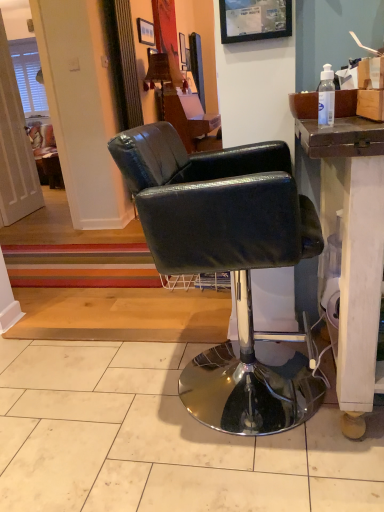
At what (x,y) coordinates should I click in order to perform the action: click on transparent plastic bottle at upper right. Please return your answer as a coordinate pair (x, y). The height and width of the screenshot is (512, 384). Looking at the image, I should click on (326, 97).

The image size is (384, 512). What do you see at coordinates (145, 32) in the screenshot? I see `matte black picture frame at upper center, which is counted as the first picture frame, starting from the top` at bounding box center [145, 32].

Measure the distance between point (255, 267) and camera.

1.12 meters.

The image size is (384, 512). What do you see at coordinates (254, 20) in the screenshot?
I see `matte plastic picture frame at upper center, placed as the first picture frame when sorted from bottom to top` at bounding box center [254, 20].

Image resolution: width=384 pixels, height=512 pixels. I want to click on transparent plastic bottle at upper right, so click(326, 97).

In terms of size, does brown cardboard box at upper right appear bigger or smaller than transparent plastic bottle at upper right?

brown cardboard box at upper right is bigger than transparent plastic bottle at upper right.

Is brown cardboard box at upper right in front of or behind transparent plastic bottle at upper right in the image?

Clearly, brown cardboard box at upper right is behind transparent plastic bottle at upper right.

Looking at this image, from a real-world perspective, which is physically below, brown cardboard box at upper right or transparent plastic bottle at upper right?

brown cardboard box at upper right is physically lower.

Do you think brown cardboard box at upper right is within white tile at center, or outside of it?

The correct answer is: outside.

Measure the distance from brown cardboard box at upper right to white tile at center.

brown cardboard box at upper right is 1.15 meters away from white tile at center.

Where is `tile that appears in front of the brown cardboard box at upper right`? tile that appears in front of the brown cardboard box at upper right is located at coordinates (159, 440).

From the picture: Considering the sizes of objects brown cardboard box at upper right and white tile at center in the image provided, who is thinner, brown cardboard box at upper right or white tile at center?

With smaller width is brown cardboard box at upper right.

Is brown cardboard box at upper right facing towards wooden lampshade at upper center?

No, brown cardboard box at upper right is not turned towards wooden lampshade at upper center.

Does brown cardboard box at upper right contain wooden lampshade at upper center?

No.

Which is more to the left, brown cardboard box at upper right or wooden lampshade at upper center?

wooden lampshade at upper center.

Which is farther from the camera, (273, 8) or (329, 88)?

The point (273, 8) is farther.

Would you say transparent plastic bottle at upper right is part of matte plastic picture frame at upper center, which appears as the 2th picture frame when viewed from the back,'s contents?

That's incorrect, transparent plastic bottle at upper right is not inside matte plastic picture frame at upper center, which appears as the 2th picture frame when viewed from the back.

Is matte plastic picture frame at upper center, the first picture frame in the front-to-back sequence, to the left or to the right of transparent plastic bottle at upper right in the image?

From the image, it's evident that matte plastic picture frame at upper center, the first picture frame in the front-to-back sequence, is to the left of transparent plastic bottle at upper right.

Does black leather chair at center have a greater width compared to transparent plastic bottle at upper right?

Correct, the width of black leather chair at center exceeds that of transparent plastic bottle at upper right.

Is black leather chair at center to the left of transparent plastic bottle at upper right from the viewer's perspective?

Yes, black leather chair at center is to the left of transparent plastic bottle at upper right.

From a real-world perspective, is black leather chair at center physically above transparent plastic bottle at upper right?

No, from a real-world perspective, black leather chair at center is not on top of transparent plastic bottle at upper right.

Would you say black leather chair at center contains transparent plastic bottle at upper right?

Actually, transparent plastic bottle at upper right is outside black leather chair at center.

Considering the points (330, 66) and (349, 103), which point is behind, point (330, 66) or point (349, 103)?

The point (330, 66) is more distant.

Is transparent plastic bottle at upper right closer to the viewer compared to brown cardboard box at upper right?

That is True.

In the scene shown: Is transparent plastic bottle at upper right outside of brown cardboard box at upper right?

Yes, transparent plastic bottle at upper right is outside of brown cardboard box at upper right.

From the image's perspective, which one is positioned higher, transparent plastic bottle at upper right or brown cardboard box at upper right?

brown cardboard box at upper right is shown above in the image.

Can you confirm if wooden lampshade at upper center is positioned to the right of transparent plastic bottle at upper right?

No.

Between wooden lampshade at upper center and transparent plastic bottle at upper right, which one has larger width?

wooden lampshade at upper center.

Can you confirm if wooden lampshade at upper center is bigger than transparent plastic bottle at upper right?

Correct, wooden lampshade at upper center is larger in size than transparent plastic bottle at upper right.

The width and height of the screenshot is (384, 512). Identify the location of bottle on the left of brown cardboard box at upper right. (326, 97).

This screenshot has height=512, width=384. I want to click on box above the white tile at center (from a real-world perspective), so click(x=304, y=105).

When comparing their distances from wooden lampshade at upper center, does matte black picture frame at upper center, the 2th picture frame in the bottom-to-top sequence, or matte plastic picture frame at upper center, the first picture frame in the front-to-back sequence, seem closer?

matte black picture frame at upper center, the 2th picture frame in the bottom-to-top sequence.

Estimate the real-world distances between objects in this image. Which object is closer to transparent plastic bottle at upper right, brown cardboard box at upper right or white tile at center?

The object closer to transparent plastic bottle at upper right is brown cardboard box at upper right.

When comparing their distances from matte plastic picture frame at upper center, the 1th picture frame when ordered from right to left, does black leather chair at center or white tile at center seem further?

Based on the image, white tile at center appears to be further to matte plastic picture frame at upper center, the 1th picture frame when ordered from right to left.

Estimate the real-world distances between objects in this image. Which object is closer to matte black picture frame at upper center, which is counted as the first picture frame, starting from the top, wooden lampshade at upper center or transparent plastic bottle at upper right?

wooden lampshade at upper center is positioned closer to the anchor matte black picture frame at upper center, which is counted as the first picture frame, starting from the top.

In the scene shown: Which object lies nearer to the anchor point matte black picture frame at upper center, which is counted as the 2th picture frame, starting from the front, matte plastic picture frame at upper center, placed as the first picture frame when sorted from bottom to top, or white tile at center?

matte plastic picture frame at upper center, placed as the first picture frame when sorted from bottom to top, lies closer to matte black picture frame at upper center, which is counted as the 2th picture frame, starting from the front, than the other object.

Considering their positions, is brown cardboard box at upper right positioned closer to white tile at center than matte black picture frame at upper center, which is counted as the 2th picture frame, starting from the front?

brown cardboard box at upper right is closer to white tile at center.

In the scene shown: From the image, which object appears to be farther from matte black picture frame at upper center, which is counted as the 2th picture frame, starting from the front, black leather chair at center or wooden lampshade at upper center?

black leather chair at center is positioned further to the anchor matte black picture frame at upper center, which is counted as the 2th picture frame, starting from the front.

Estimate the real-world distances between objects in this image. Which object is closer to matte black picture frame at upper center, which is counted as the 2th picture frame, starting from the right, matte plastic picture frame at upper center, placed as the first picture frame when sorted from bottom to top, or brown cardboard box at upper right?

matte plastic picture frame at upper center, placed as the first picture frame when sorted from bottom to top.

Where is `chair that lies between brown cardboard box at upper right and white tile at center from top to bottom`? The width and height of the screenshot is (384, 512). chair that lies between brown cardboard box at upper right and white tile at center from top to bottom is located at coordinates (226, 261).

At what (x,y) coordinates should I click in order to perform the action: click on picture frame between transparent plastic bottle at upper right and matte black picture frame at upper center, acting as the 1th picture frame starting from the left, from front to back. Please return your answer as a coordinate pair (x, y). The image size is (384, 512). Looking at the image, I should click on (254, 20).

Locate an element on the screen. This screenshot has height=512, width=384. picture frame located between black leather chair at center and wooden lampshade at upper center in the depth direction is located at coordinates (254, 20).

At what (x,y) coordinates should I click in order to perform the action: click on picture frame between black leather chair at center and matte black picture frame at upper center, which is counted as the 2th picture frame, starting from the right, along the z-axis. Please return your answer as a coordinate pair (x, y). This screenshot has height=512, width=384. Looking at the image, I should click on (254, 20).